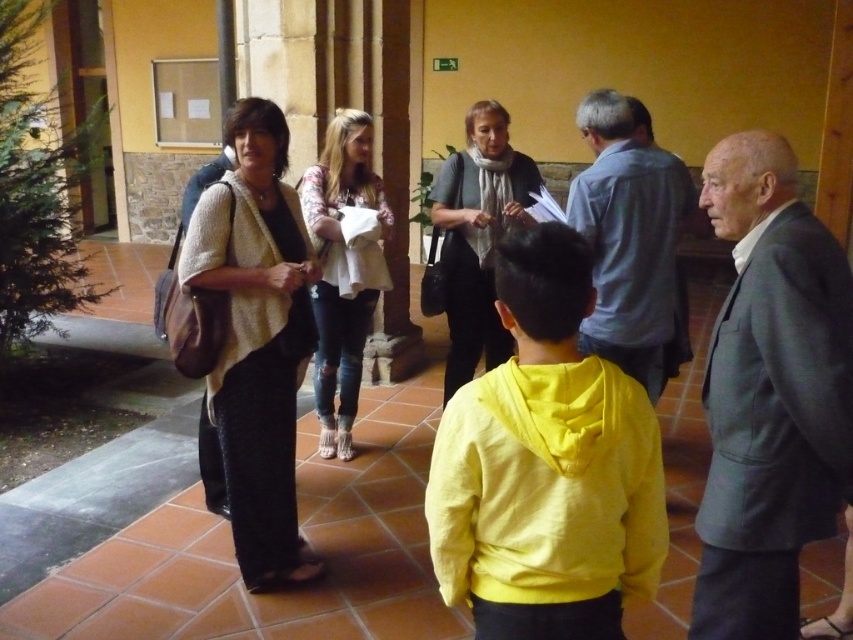
You are a photographer positioned at the entrance of the building. You want to take a photo that includes both the gray wool suit at right and the light blue shirt at center. Based on their positions, which one should you adjust your camera angle to focus on first to ensure both are in frame?

The gray wool suit at right is to the left of the light blue shirt at center, so you should adjust your camera angle to focus on the light blue shirt at center first to ensure both are in frame.

You are organizing a clothing donation drive and need to categorize items by size. You have two items to sort out in the image provided. Which of the two items, the gray wool suit at right or the light blue shirt at center, would you place in the medium size bin?

The gray wool suit at right has a smaller size compared to light blue shirt at center, so the gray wool suit at right should be placed in the small size bin and the light blue shirt at center in the medium size bin.